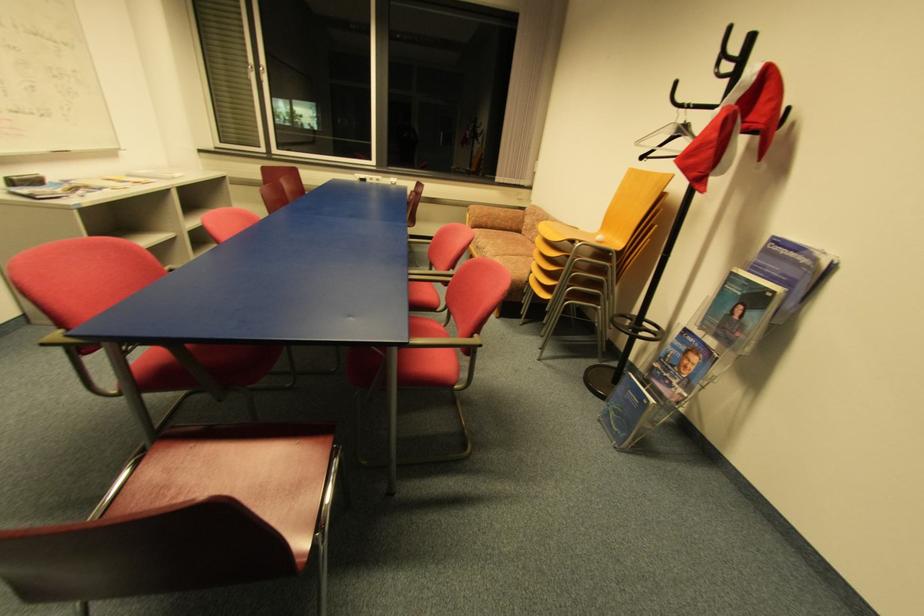
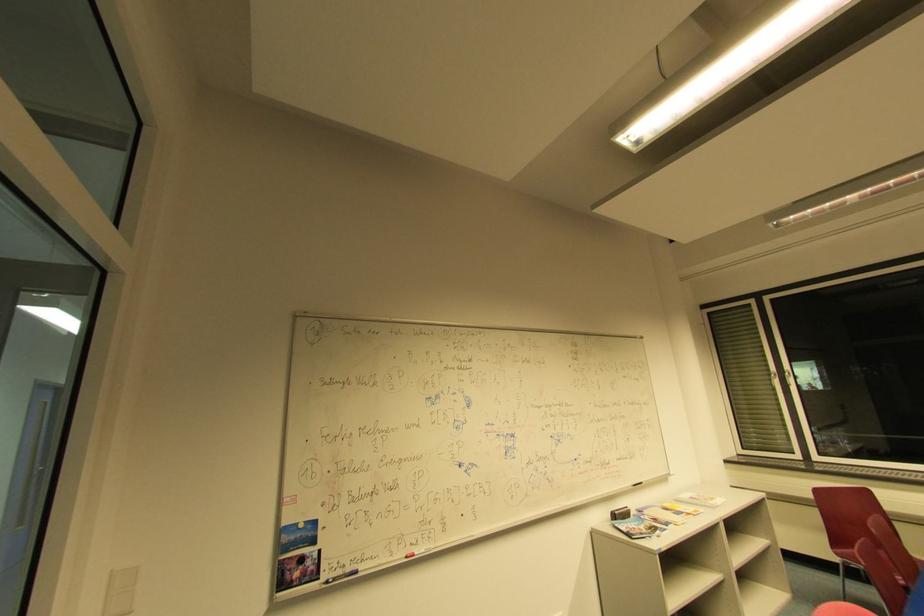
Where in the second image is the point corresponding to [266,70] from the first image?

(791, 375)